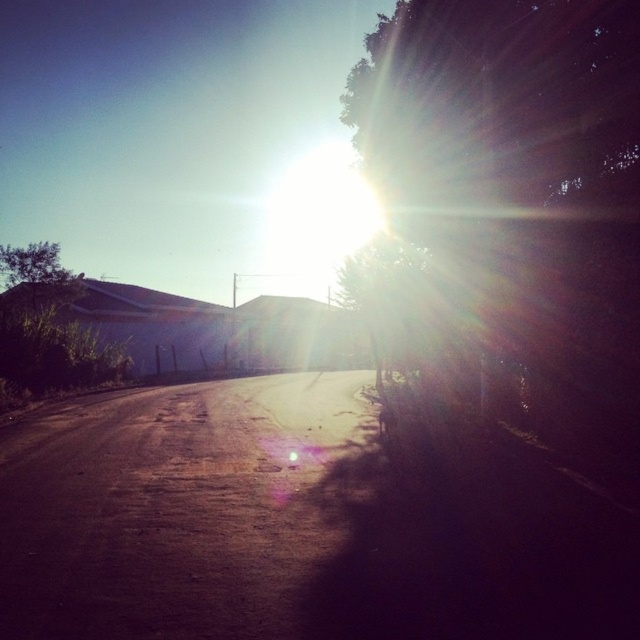
You are standing at the starting point of the dull brown dirt track at center and want to walk towards the green leafy tree at upper left. Which direction should you head?

The green leafy tree at upper left is to the left of the dull brown dirt track at center, so you should head left to reach it.

What is the spatial relationship between the green leafy tree at upper right and the green leafy tree at upper left in the scene?

The green leafy tree at upper right is positioned to the right of the green leafy tree at upper left.